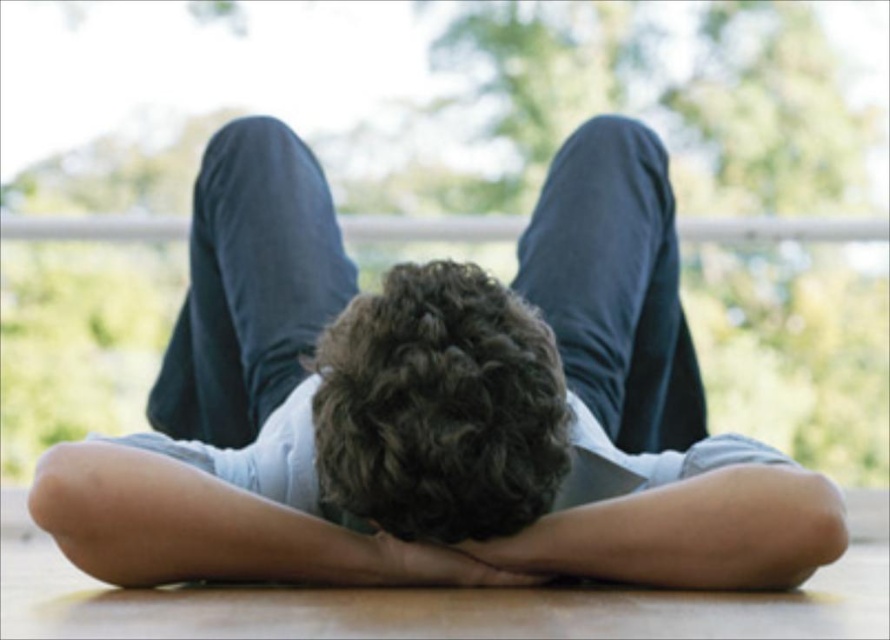
You are a fashion designer observing the person in the image. You want to place a belt horizontally across the light blue denim shorts at center and the smooth skin hand at center. Which object should the belt be placed on top of to ensure it is visible?

The belt should be placed on top of the light blue denim shorts at center because it has a greater height compared to the smooth skin hand at center, making it more prominent.

Based on the photo, you are a fashion designer observing a person in the image. The person is wearing light blue denim shorts at center and has dark curly hair at center. Which clothing item is positioned higher on their body?

The light blue denim shorts at center is above dark curly hair at center, so the light blue denim shorts at center is positioned higher on their body.

You are a photographer trying to capture the person in the scene. If you want to focus on the dark curly hair at center without the smooth skin hand at center being visible, which part should you adjust in your composition?

The dark curly hair at center is in front of the smooth skin hand at center, so to focus on the dark curly hair at center without showing the smooth skin hand at center, you should adjust your composition to frame the shot so that the dark curly hair at center obscures the view of the smooth skin hand at center.